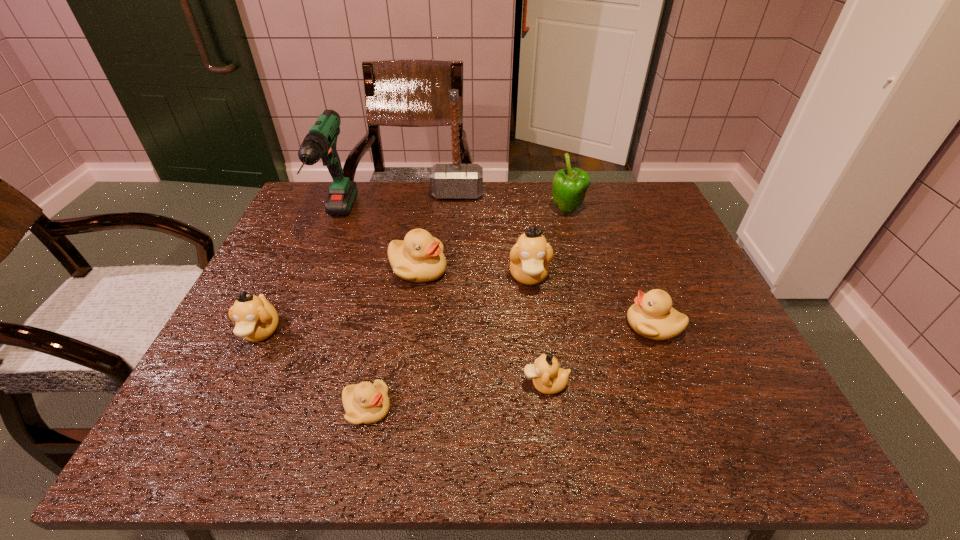
Find the location of `bell pepper that is at the far edge`. bell pepper that is at the far edge is located at coordinates pyautogui.click(x=570, y=185).

This screenshot has width=960, height=540. I want to click on object that is positioned at the near edge, so click(x=365, y=403).

Identify the location of drill at the left edge. (320, 142).

Locate an element on the screen. duckling located in the left edge section of the desktop is located at coordinates (256, 319).

What are the coordinates of `object that is at the right edge` in the screenshot? It's located at (652, 316).

You are a GUI agent. You are given a task and a screenshot of the screen. Output one action in this format:
    pyautogui.click(x=<x>, y=<y>)
    Task: Click on the object that is at the far left corner
    This screenshot has width=960, height=540.
    Given the screenshot: What is the action you would take?
    click(320, 142)

Where is `vacant area at the far edge`? The image size is (960, 540). vacant area at the far edge is located at coordinates (390, 200).

The width and height of the screenshot is (960, 540). In the image, there is a desktop. Identify the location of vacant space at the near edge. (374, 442).

In the image, there is a desktop. Where is `vacant space at the left edge`? This screenshot has height=540, width=960. vacant space at the left edge is located at coordinates (248, 342).

In the image, there is a desktop. Where is `vacant space at the right edge`? Image resolution: width=960 pixels, height=540 pixels. vacant space at the right edge is located at coordinates (688, 290).